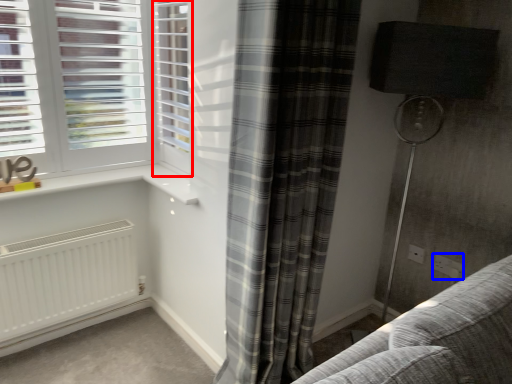
Question: Which of the following is the farthest to the observer, screen door (highlighted by a red box) or electric outlet (highlighted by a blue box)?

Choices:
 (A) screen door
 (B) electric outlet

Answer: (B)